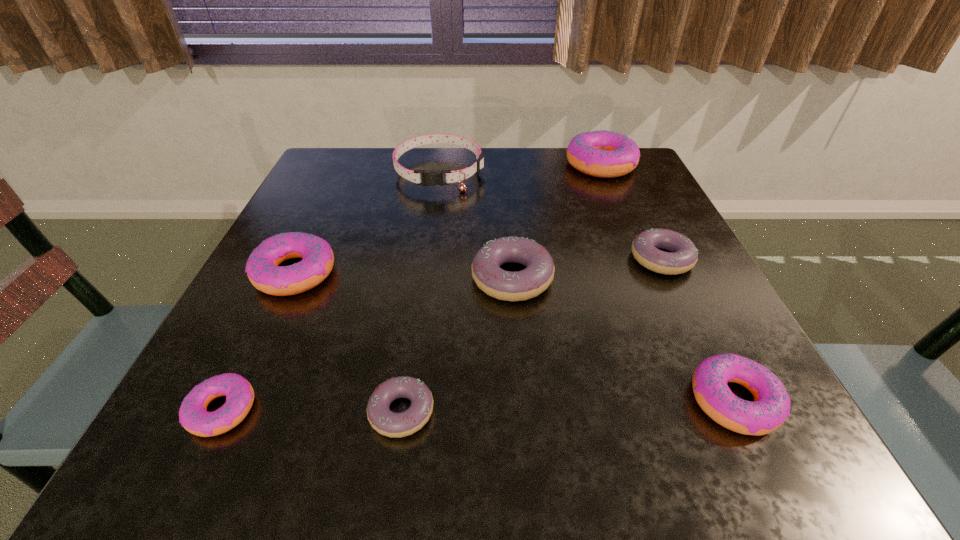
Find the location of `the smallest pink doughnut`. the smallest pink doughnut is located at coordinates (193, 416).

Where is `free space located 0.350m on the front of the farthest pink doughnut`? free space located 0.350m on the front of the farthest pink doughnut is located at coordinates click(649, 279).

At what (x,y) coordinates should I click in order to perform the action: click on vacant region located with the buckle on the dog collar. Please return your answer as a coordinate pair (x, y). Looking at the image, I should click on (431, 233).

Find the location of a particular element. Image resolution: width=960 pixels, height=540 pixels. free region located 0.100m on the front of the second purple doughnut from left to right is located at coordinates (518, 354).

The width and height of the screenshot is (960, 540). Identify the location of vacant region located on the back of the third smallest pink doughnut. (347, 164).

I want to click on blank space located 0.200m on the front of the rightmost purple doughnut, so click(714, 370).

This screenshot has width=960, height=540. What are the coordinates of `blank area located 0.240m on the left of the third biggest pink doughnut` in the screenshot? It's located at (518, 400).

Locate an element on the screen. blank space located on the right of the nearest purple doughnut is located at coordinates (507, 411).

You are a GUI agent. You are given a task and a screenshot of the screen. Output one action in this format:
    pyautogui.click(x=<x>, y=<y>)
    Task: Click on the free location located 0.150m on the back of the smallest pink doughnut
    This screenshot has width=960, height=540.
    Given the screenshot: What is the action you would take?
    pyautogui.click(x=272, y=307)

The height and width of the screenshot is (540, 960). Identify the location of doughnut positioned at the far edge. (605, 154).